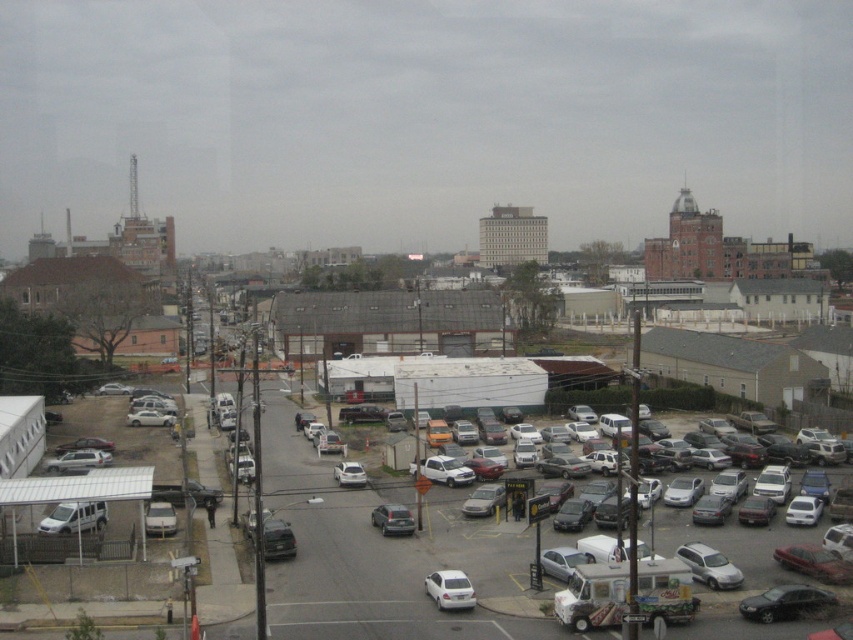
Consider the image. You are standing at the bus stop shelter with a white roof and want to walk to the parking lot in the middle ground. There are two points marked on the path you might take. Which point, point 1 at coordinates [691,561] or point 2 at [166,518], is closer to you as you start walking towards the parking lot?

Point 1 at coordinates [691,561] is closer to you because it is nearer to the viewer compared to point 2 at [166,518].

You are a delivery person needing to move a large package from the satin silver minivan at lower right to the matte silver van at lower left. Given that your dolly can only handle distances up to 80 feet, will you be able to transport the package without needing assistance?

The distance between the satin silver minivan at lower right and the matte silver van at lower left is 86.13 feet, which exceeds the dollys 80 feet limit. Therefore, you will need assistance to transport the package.

You are a delivery person trying to access the sidewalk near the covered structure. You see the matte black sedan at lower right and the satin silver minivan at lower right blocking the path. Which vehicle is directly above the other, making it harder to pass?

The satin silver minivan at lower right is directly above the matte black sedan at lower right, so the minivan is blocking the sedan, making it harder to pass.